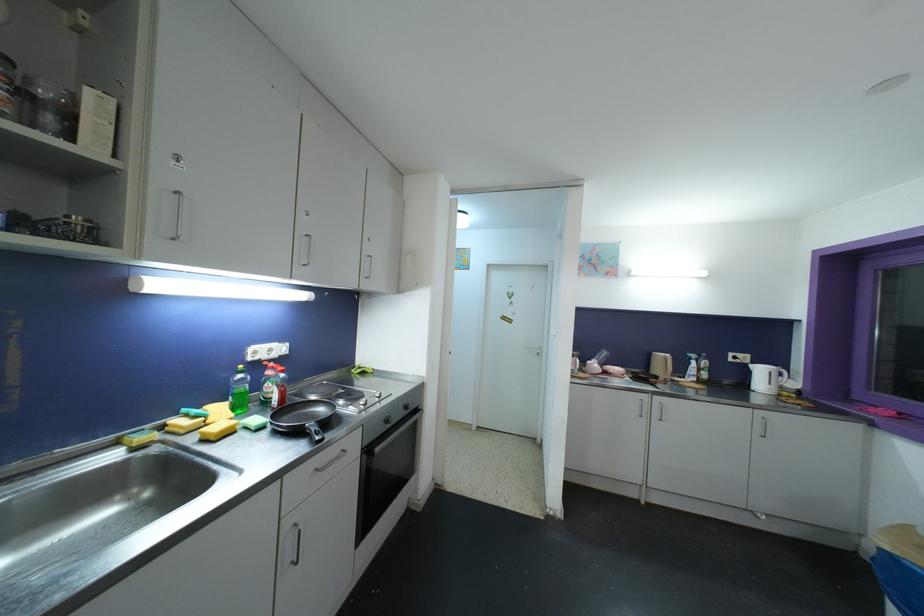
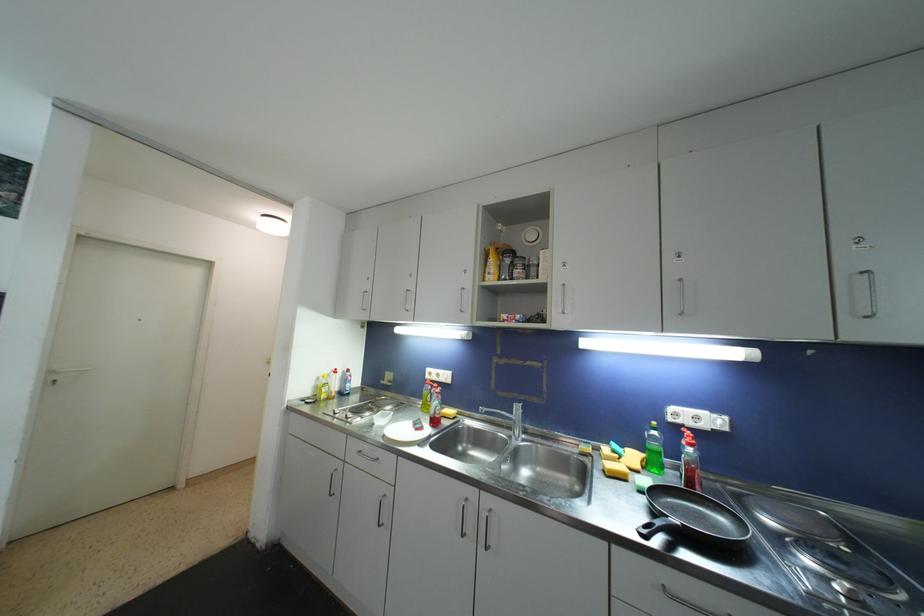
Where in the second image is the point corresponding to pixel 272 376 from the first image?

(687, 445)